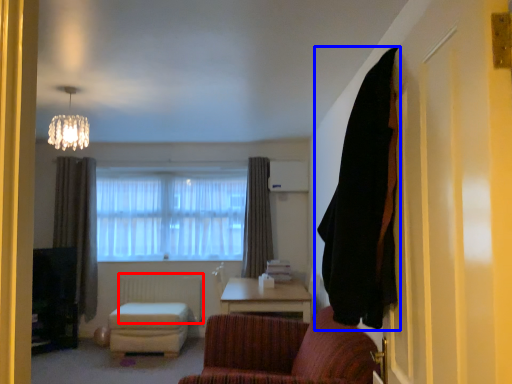
Question: Which of the following is the farthest to the observer, radiator (highlighted by a red box) or curtain (highlighted by a blue box)?

Choices:
 (A) radiator
 (B) curtain

Answer: (A)